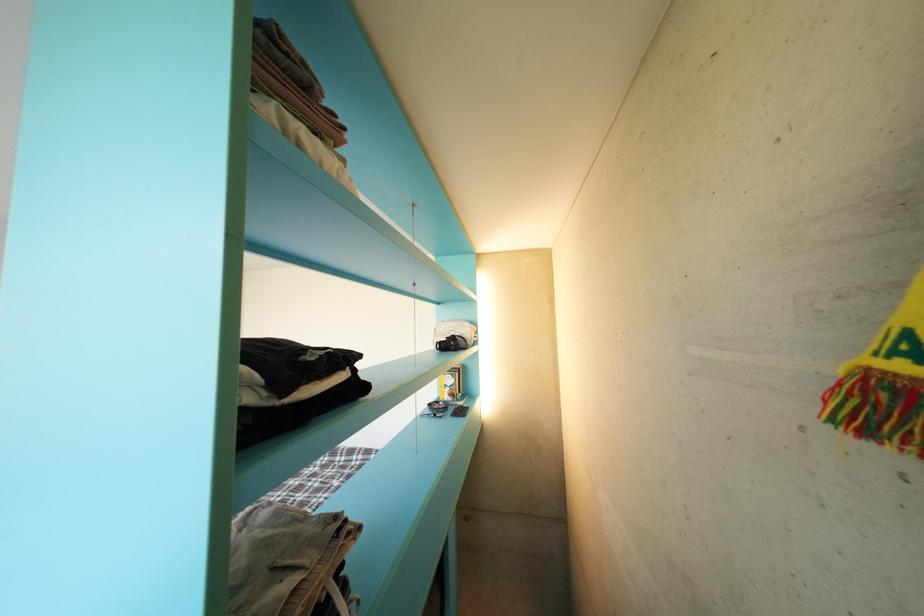
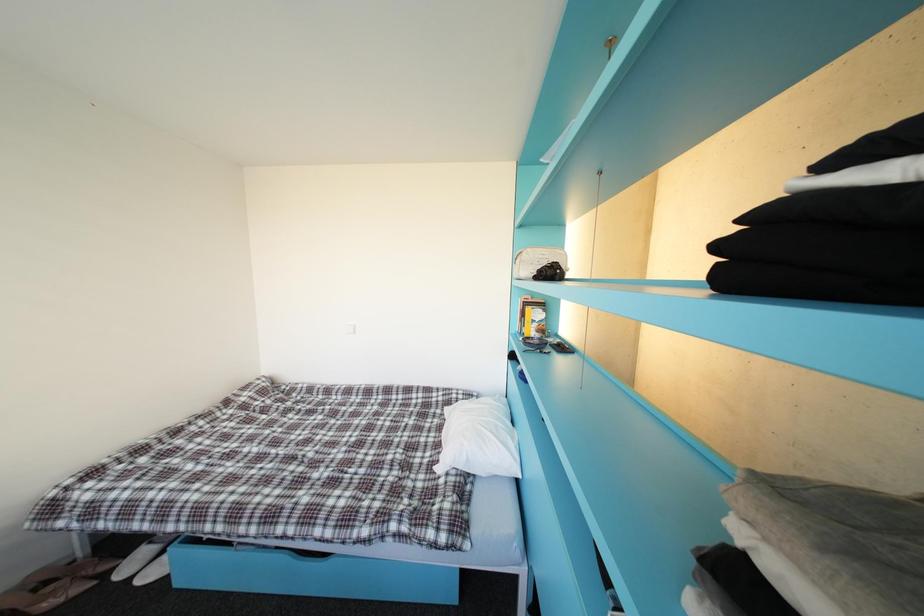
Question: The first image is from the beginning of the video and the second image is from the end. How did the camera likely rotate when shooting the video?

Choices:
 (A) Left
 (B) Right
 (C) Up
 (D) Down

Answer: (D)